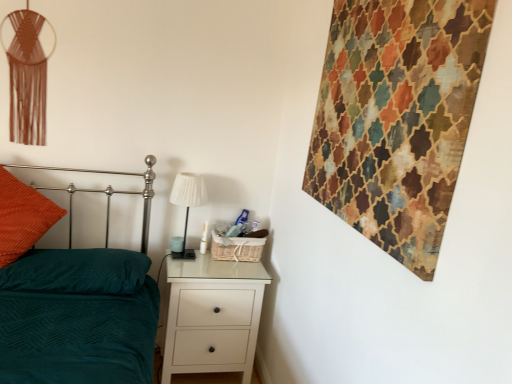
Locate an element on the screen. white glossy chest of drawers at lower center is located at coordinates (212, 316).

Looking at this image, what is the approximate width of teal fabric bed at left?

It is 1.93 meters.

The width and height of the screenshot is (512, 384). Describe the element at coordinates (78, 317) in the screenshot. I see `teal fabric bed at left` at that location.

What do you see at coordinates (22, 217) in the screenshot?
I see `orange textured pillow at left` at bounding box center [22, 217].

What do you see at coordinates (77, 271) in the screenshot? I see `teal fabric pillow at lower left` at bounding box center [77, 271].

Identify the location of teal fabric pillow at lower left. (77, 271).

Where is `white fabric lampshade at center`? The image size is (512, 384). white fabric lampshade at center is located at coordinates (188, 203).

Between teal fabric bed at left and orange textured pillow at left, which one has more height?

With more height is teal fabric bed at left.

From the image's perspective, is teal fabric bed at left beneath orange textured pillow at left?

Yes, from the image's perspective, teal fabric bed at left is below orange textured pillow at left.

Is teal fabric bed at left far away from orange textured pillow at left?

That's not correct — teal fabric bed at left is a little close to orange textured pillow at left.

Does teal fabric pillow at lower left touch white fabric lampshade at center?

teal fabric pillow at lower left and white fabric lampshade at center are not in contact.

Is teal fabric pillow at lower left looking in the opposite direction of white fabric lampshade at center?

teal fabric pillow at lower left is not turned away from white fabric lampshade at center.

From a real-world perspective, is teal fabric pillow at lower left beneath white fabric lampshade at center?

Correct, in the physical world, teal fabric pillow at lower left is lower than white fabric lampshade at center.

Which of these two, teal fabric pillow at lower left or white fabric lampshade at center, is wider?

Wider between the two is teal fabric pillow at lower left.

From the picture: In the image, is teal fabric bed at left positioned in front of or behind white fabric lampshade at center?

Visually, teal fabric bed at left is located in front of white fabric lampshade at center.

Locate an element on the screen. bed below the white fabric lampshade at center (from the image's perspective) is located at coordinates (78, 317).

Considering the sizes of teal fabric bed at left and white fabric lampshade at center in the image, is teal fabric bed at left wider or thinner than white fabric lampshade at center?

Clearly, teal fabric bed at left has more width compared to white fabric lampshade at center.

From a real-world perspective, is orange textured pillow at left physically located above or below white glossy chest of drawers at lower center?

In terms of real-world spatial position, orange textured pillow at left is above white glossy chest of drawers at lower center.

Considering the relative sizes of orange textured pillow at left and white glossy chest of drawers at lower center in the image provided, is orange textured pillow at left wider than white glossy chest of drawers at lower center?

Indeed, orange textured pillow at left has a greater width compared to white glossy chest of drawers at lower center.

Between orange textured pillow at left and white glossy chest of drawers at lower center, which one has more height?

white glossy chest of drawers at lower center.

The height and width of the screenshot is (384, 512). What are the coordinates of `the chest of drawers that appears below the orange textured pillow at left (from a real-world perspective)` in the screenshot? It's located at (212, 316).

From a real-world perspective, is orange textured pillow at left positioned over white fabric lampshade at center based on gravity?

No, from a real-world perspective, orange textured pillow at left is not on top of white fabric lampshade at center.

The image size is (512, 384). Identify the location of throw pillow on the left of white fabric lampshade at center. (22, 217).

From the image's perspective, is orange textured pillow at left located above or below white fabric lampshade at center?

From the image's perspective, orange textured pillow at left appears below white fabric lampshade at center.

Can you tell me how much white glossy chest of drawers at lower center and teal fabric bed at left differ in facing direction?

The facing directions of white glossy chest of drawers at lower center and teal fabric bed at left are 0.439 degrees apart.

Is white glossy chest of drawers at lower center further to the viewer compared to teal fabric bed at left?

That is True.

Is white glossy chest of drawers at lower center far away from teal fabric bed at left?

They are positioned close to each other.

Is teal fabric pillow at lower left wider or thinner than teal fabric bed at left?

Clearly, teal fabric pillow at lower left has less width compared to teal fabric bed at left.

Which object is closer to the camera taking this photo, teal fabric pillow at lower left or teal fabric bed at left?

teal fabric bed at left is closer to the camera.

In the scene shown: From a real-world perspective, is teal fabric pillow at lower left over teal fabric bed at left?

Indeed, from a real-world perspective, teal fabric pillow at lower left stands above teal fabric bed at left.

In the scene shown: From the image's perspective, is teal fabric pillow at lower left located above or below teal fabric bed at left?

Clearly, from the image's perspective, teal fabric pillow at lower left is above teal fabric bed at left.

There is a teal fabric bed at left. Identify the location of throw pillow above it (from a real-world perspective). (22, 217).

Where is `table lamp above the teal fabric pillow at lower left (from the image's perspective)`? This screenshot has height=384, width=512. table lamp above the teal fabric pillow at lower left (from the image's perspective) is located at coordinates click(x=188, y=203).

Looking at the image, which one is located closer to white fabric lampshade at center, textured multicolored tapestry at upper right or white glossy chest of drawers at lower center?

white glossy chest of drawers at lower center is closer to white fabric lampshade at center.

Considering their positions, is teal fabric bed at left positioned closer to white glossy chest of drawers at lower center than textured multicolored tapestry at upper right?

The object closer to white glossy chest of drawers at lower center is teal fabric bed at left.

Based on their spatial positions, is orange textured pillow at left or teal fabric pillow at lower left closer to white glossy chest of drawers at lower center?

teal fabric pillow at lower left is closer to white glossy chest of drawers at lower center.

Looking at the image, which one is located further to textured multicolored tapestry at upper right, teal fabric bed at left or white fabric lampshade at center?

white fabric lampshade at center is positioned further to the anchor textured multicolored tapestry at upper right.

Considering their positions, is white glossy chest of drawers at lower center positioned further to teal fabric pillow at lower left than teal fabric bed at left?

Based on the image, white glossy chest of drawers at lower center appears to be further to teal fabric pillow at lower left.

Estimate the real-world distances between objects in this image. Which object is further from textured multicolored tapestry at upper right, teal fabric bed at left or orange textured pillow at left?

orange textured pillow at left.

Based on their spatial positions, is orange textured pillow at left or white fabric lampshade at center further from teal fabric pillow at lower left?

white fabric lampshade at center is further to teal fabric pillow at lower left.

When comparing their distances from teal fabric pillow at lower left, does white glossy chest of drawers at lower center or white fabric lampshade at center seem further?

white fabric lampshade at center is further to teal fabric pillow at lower left.

Identify the location of tapestry between teal fabric bed at left and white fabric lampshade at center along the z-axis. (397, 118).

The width and height of the screenshot is (512, 384). Identify the location of throw pillow between teal fabric bed at left and white glossy chest of drawers at lower center from front to back. (22, 217).

Where is `chest of drawers between textured multicolored tapestry at upper right and white fabric lampshade at center from front to back`? chest of drawers between textured multicolored tapestry at upper right and white fabric lampshade at center from front to back is located at coordinates (212, 316).

The width and height of the screenshot is (512, 384). What are the coordinates of `pillow between orange textured pillow at left and white glossy chest of drawers at lower center` in the screenshot? It's located at (77, 271).